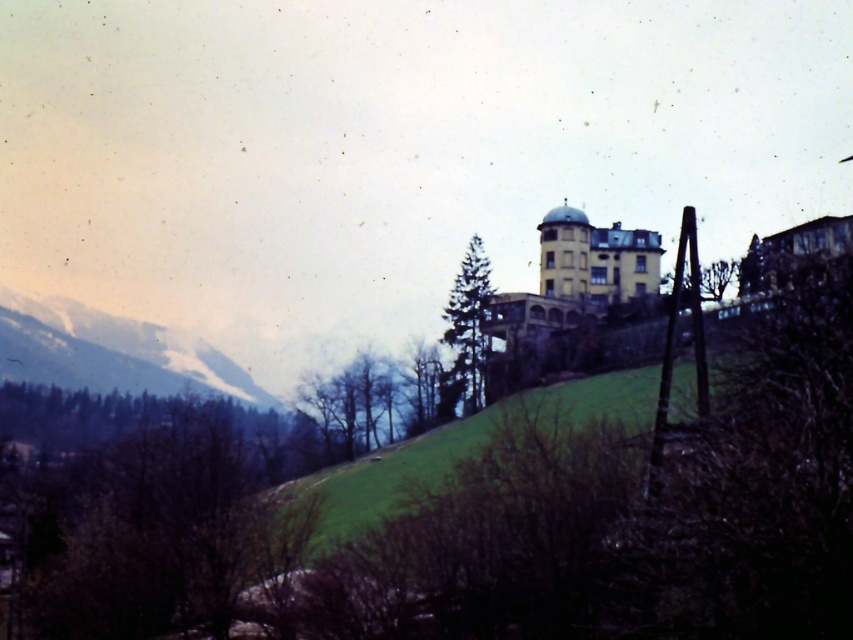
Between snowy rocky mountain at left and green textured tree at center, which one is positioned lower?

snowy rocky mountain at left is below.

Identify the location of snowy rocky mountain at left. This screenshot has width=853, height=640. (109, 352).

Does snowy rocky mountain at left appear over green leafy tree at center?

Indeed, snowy rocky mountain at left is positioned over green leafy tree at center.

Does snowy rocky mountain at left appear on the right side of green leafy tree at center?

Incorrect, snowy rocky mountain at left is not on the right side of green leafy tree at center.

Between point (109, 385) and point (428, 360), which one is positioned behind?

Positioned behind is point (109, 385).

The height and width of the screenshot is (640, 853). I want to click on snowy rocky mountain at left, so click(x=109, y=352).

Can you confirm if green textured tree at center is shorter than green leafy tree at center?

No, green textured tree at center is not shorter than green leafy tree at center.

Between green textured tree at center and green leafy tree at center, which one appears on the left side from the viewer's perspective?

green leafy tree at center is more to the left.

Is point (485, 339) closer to camera compared to point (419, 403)?

Yes, it is in front of point (419, 403).

The width and height of the screenshot is (853, 640). Find the location of `green textured tree at center`. green textured tree at center is located at coordinates (469, 323).